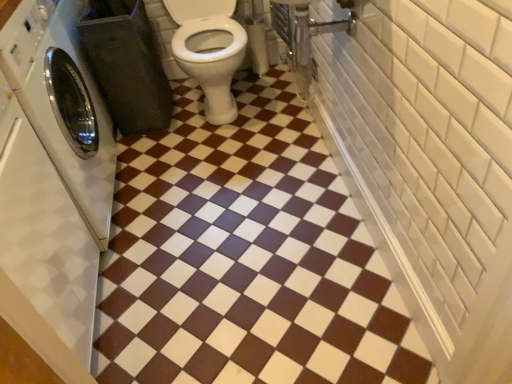
Question: Would you say brown glossy tile at center is inside or outside white glossy washing machine at left?

Choices:
 (A) inside
 (B) outside

Answer: (B)

Question: From the image's perspective, relative to white glossy washing machine at left, is brown glossy tile at center above or below?

Choices:
 (A) below
 (B) above

Answer: (A)

Question: Is brown glossy tile at center to the left or to the right of white glossy washing machine at left in the image?

Choices:
 (A) right
 (B) left

Answer: (A)

Question: In terms of height, does white glossy washing machine at left look taller or shorter compared to brown glossy tile at center?

Choices:
 (A) tall
 (B) short

Answer: (A)

Question: Based on their positions, is white glossy washing machine at left located to the left or right of brown glossy tile at center?

Choices:
 (A) left
 (B) right

Answer: (A)

Question: From the image's perspective, is white glossy washing machine at left located above or below brown glossy tile at center?

Choices:
 (A) below
 (B) above

Answer: (B)

Question: From a real-world perspective, relative to brown glossy tile at center, is white glossy washing machine at left vertically above or below?

Choices:
 (A) below
 (B) above

Answer: (B)